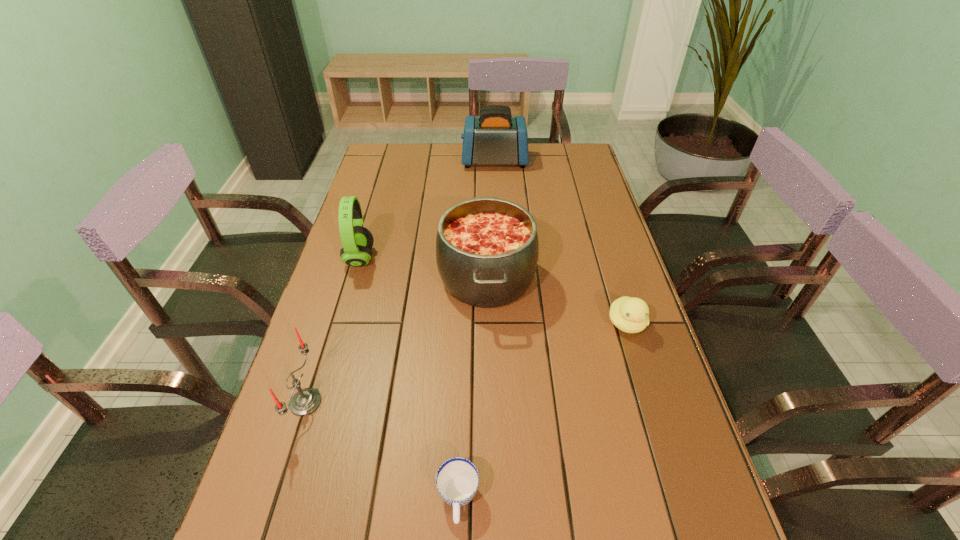
This screenshot has height=540, width=960. What are the coordinates of `toaster` in the screenshot? It's located at (495, 137).

Where is `headset`? This screenshot has height=540, width=960. headset is located at coordinates (357, 241).

You are a GUI agent. You are given a task and a screenshot of the screen. Output one action in this format:
    pyautogui.click(x=<x>, y=<y>)
    Task: Click on the casserole
    The width and height of the screenshot is (960, 540).
    Given the screenshot: What is the action you would take?
    pyautogui.click(x=487, y=249)

Find the location of a particular element. the second nearest object is located at coordinates (305, 401).

Locate an element on the screen. duckling is located at coordinates (630, 315).

The image size is (960, 540). Identify the location of the rightmost object. (630, 315).

Locate an element on the screen. The height and width of the screenshot is (540, 960). the nearest object is located at coordinates (457, 479).

Locate an element on the screen. The height and width of the screenshot is (540, 960). cup is located at coordinates (457, 479).

This screenshot has width=960, height=540. Find the location of `free region located on the front-facing side of the farthest object`. free region located on the front-facing side of the farthest object is located at coordinates (442, 161).

Where is `vacant space located on the front-facing side of the farthest object`? vacant space located on the front-facing side of the farthest object is located at coordinates (405, 161).